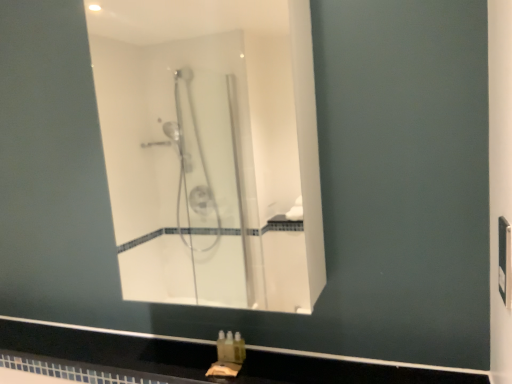
Question: Considering the positions of black glossy counter top at lower center and clear glass shower at center in the image, is black glossy counter top at lower center wider or thinner than clear glass shower at center?

Choices:
 (A) thin
 (B) wide

Answer: (B)

Question: Is black glossy counter top at lower center to the left or to the right of clear glass shower at center in the image?

Choices:
 (A) left
 (B) right

Answer: (A)

Question: Estimate the real-world distances between objects in this image. Which object is closer to the clear glass shower at center?

Choices:
 (A) translucent plastic soap at lower center
 (B) black glossy counter top at lower center

Answer: (B)

Question: Estimate the real-world distances between objects in this image. Which object is closer to the black glossy counter top at lower center?

Choices:
 (A) translucent plastic soap at lower center
 (B) clear glass shower at center

Answer: (A)